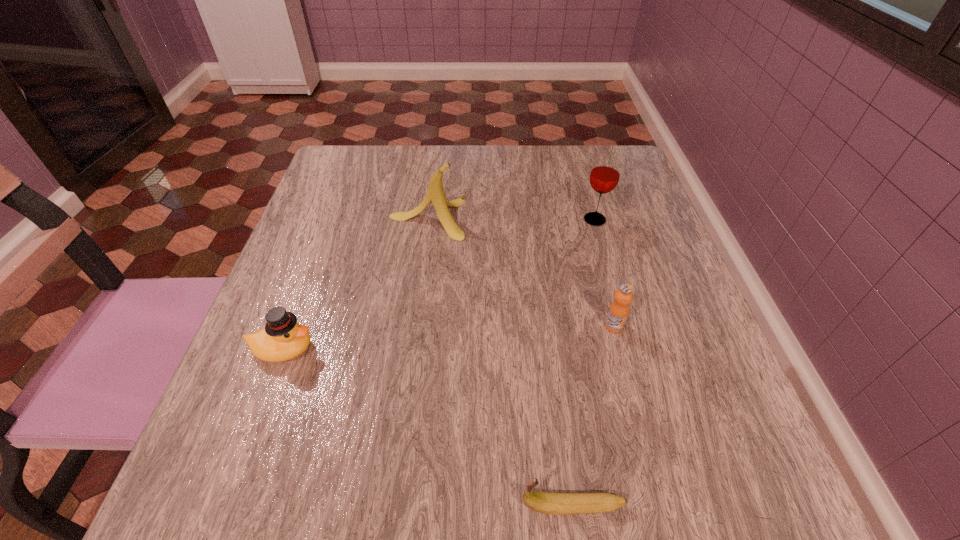
Where is `free space that satisfies the following two spatial constraints: 1. on the front label of the orange juice; 2. on the front-facing side of the duck`? free space that satisfies the following two spatial constraints: 1. on the front label of the orange juice; 2. on the front-facing side of the duck is located at coordinates (620, 349).